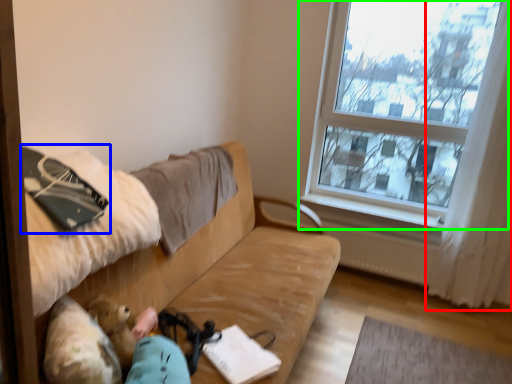
Question: Estimate the real-world distances between objects in this image. Which object is farther from curtain (highlighted by a red box), notebook (highlighted by a blue box) or window (highlighted by a green box)?

Choices:
 (A) notebook
 (B) window

Answer: (A)